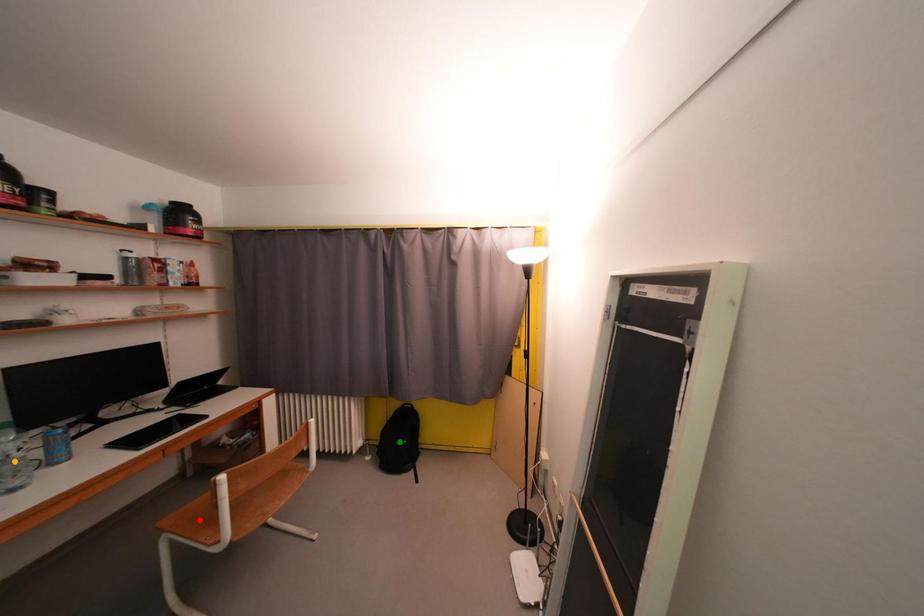
Order these from farthest to nearest:
- red point
- orange point
- green point

1. green point
2. red point
3. orange point